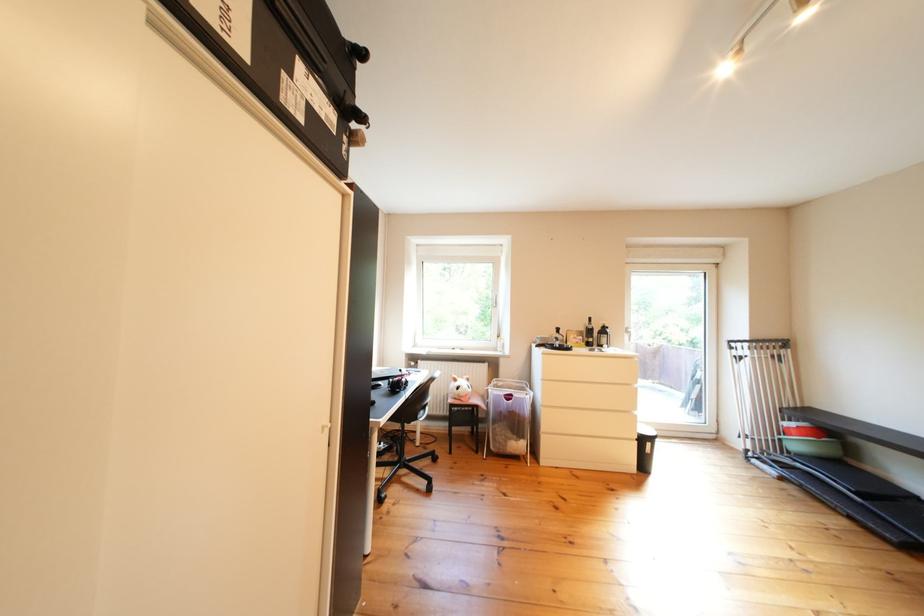
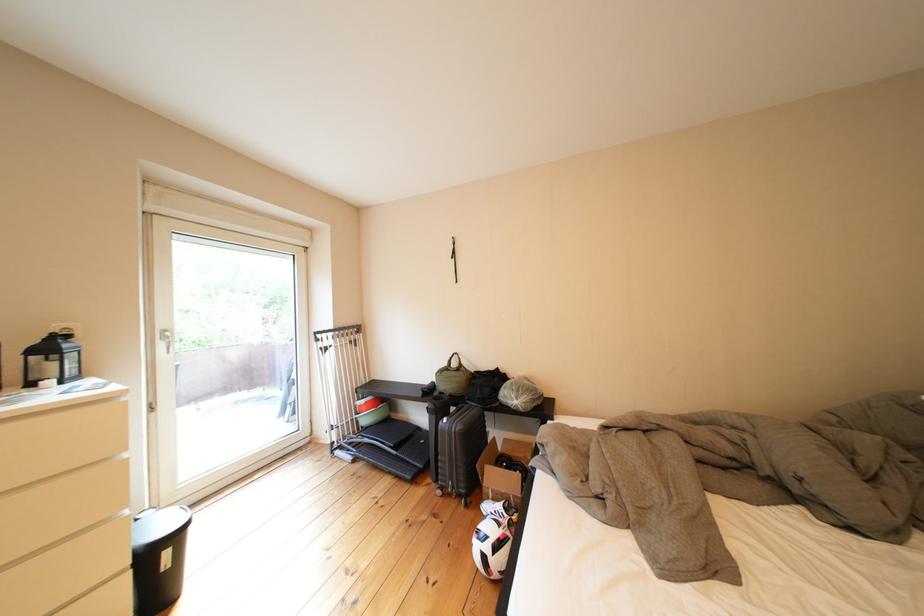
In the second image, find the point that corresponds to (x=663, y=448) in the first image.

(179, 557)